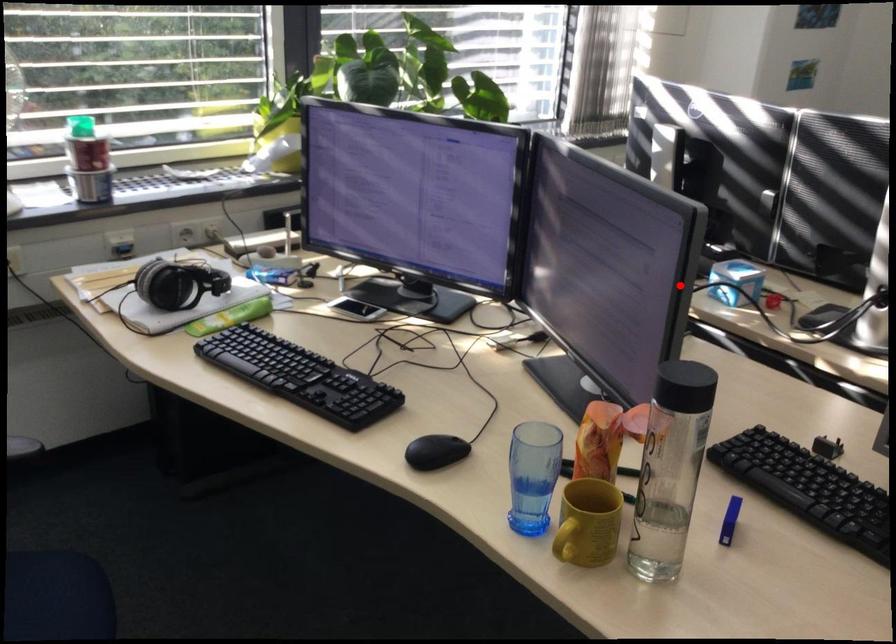
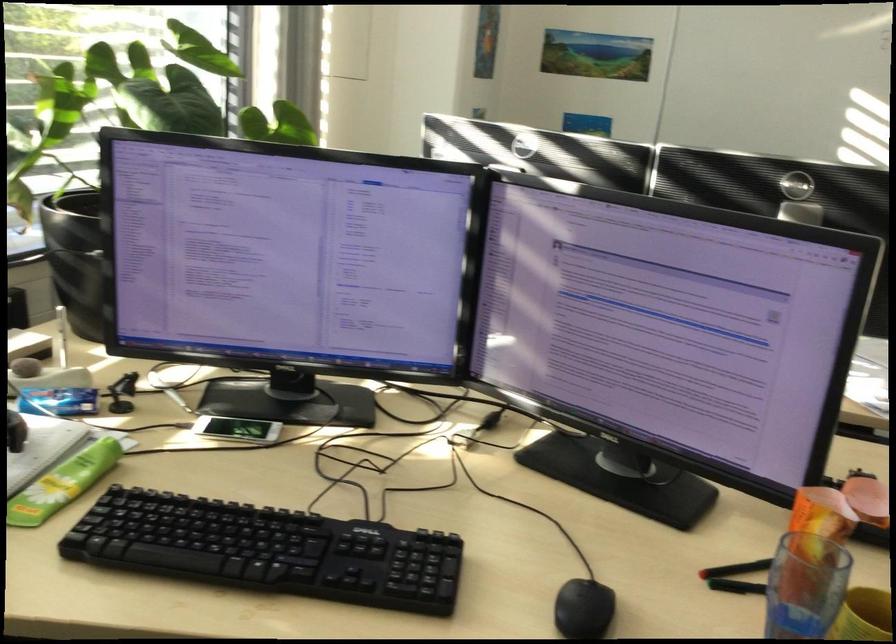
Question: A red point is marked in image1. In image2, is the corresponding 3D point closer to the camera or farther? Reply with the corresponding letter.

Choices:
 (A) The corresponding 3D point is closer.
 (B) The corresponding 3D point is farther.

Answer: (A)